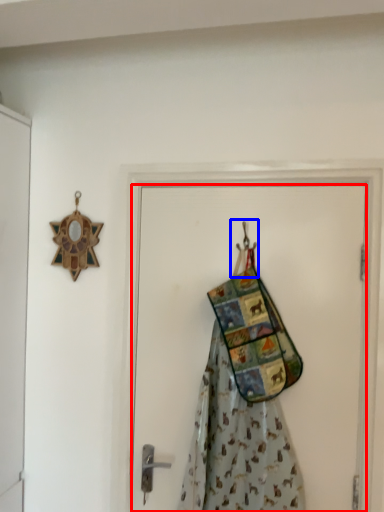
Question: Which object appears farthest to the camera in this image, door (highlighted by a red box) or hanger (highlighted by a blue box)?

Choices:
 (A) door
 (B) hanger

Answer: (B)